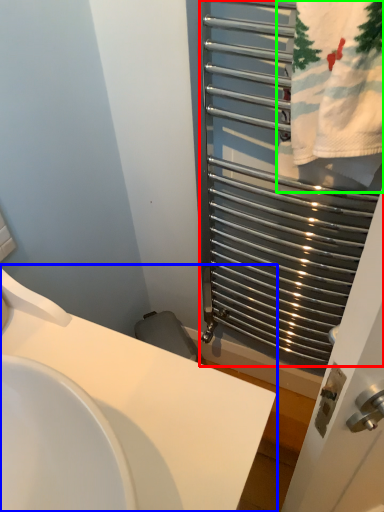
Question: Considering the real-world distances, which object is farthest from cage (highlighted by a red box)? sink (highlighted by a blue box) or bath towel (highlighted by a green box)?

Choices:
 (A) sink
 (B) bath towel

Answer: (A)